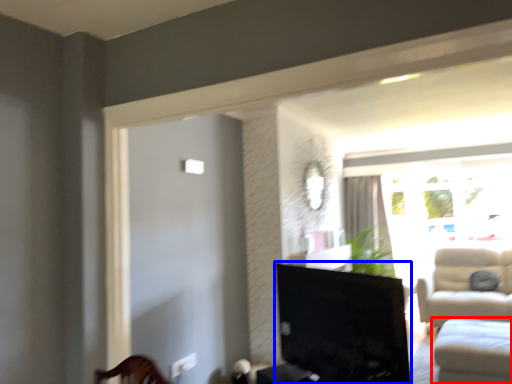
Question: Among these objects, which one is farthest to the camera, studio couch (highlighted by a red box) or furniture (highlighted by a blue box)?

Choices:
 (A) studio couch
 (B) furniture

Answer: (A)